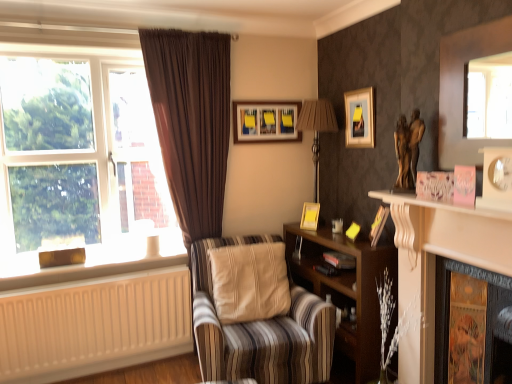
The height and width of the screenshot is (384, 512). I want to click on free space above white matte radiator at lower left (from a real-world perspective), so click(x=65, y=279).